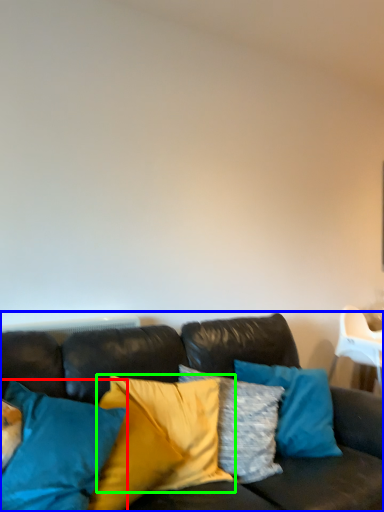
Question: Based on their relative distances, which object is farther from pillow (highlighted by a red box)? Choose from studio couch (highlighted by a blue box) and pillow (highlighted by a green box).

Choices:
 (A) studio couch
 (B) pillow

Answer: (B)